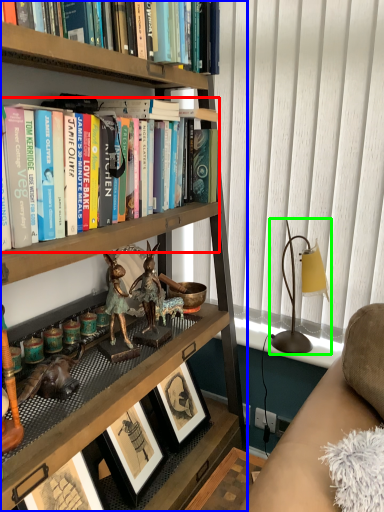
Question: Which object is the farthest from book (highlighted by a red box)? Choose among these: bookcase (highlighted by a blue box) or table lamp (highlighted by a green box).

Choices:
 (A) bookcase
 (B) table lamp

Answer: (B)